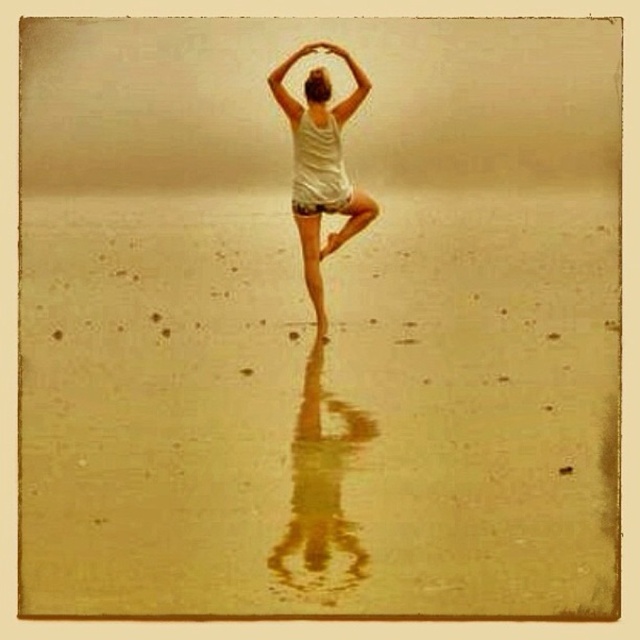
Is point (88, 280) farther from camera compared to point (314, 77)?

Yes.

Does point (124, 291) lie behind point (320, 76)?

Yes, it is.

The image size is (640, 640). Identify the location of smooth golden sand at center. (320, 408).

Can you confirm if white cotton tank top at center is bigger than smooth blonde hair at upper center?

Indeed, white cotton tank top at center has a larger size compared to smooth blonde hair at upper center.

Is point (330, 51) positioned behind point (324, 102)?

That is True.

Where is `white cotton tank top at center`? This screenshot has width=640, height=640. white cotton tank top at center is located at coordinates (326, 236).

Does smooth golden sand at center have a greater width compared to white cotton tank top at center?

Correct, the width of smooth golden sand at center exceeds that of white cotton tank top at center.

Can you confirm if smooth golden sand at center is smaller than white cotton tank top at center?

Incorrect, smooth golden sand at center is not smaller in size than white cotton tank top at center.

Between point (54, 200) and point (346, 237), which one is positioned in front?

Point (346, 237) is in front.

At what (x,y) coordinates should I click in order to perform the action: click on smooth golden sand at center. Please return your answer as a coordinate pair (x, y). This screenshot has height=640, width=640. Looking at the image, I should click on (320, 408).